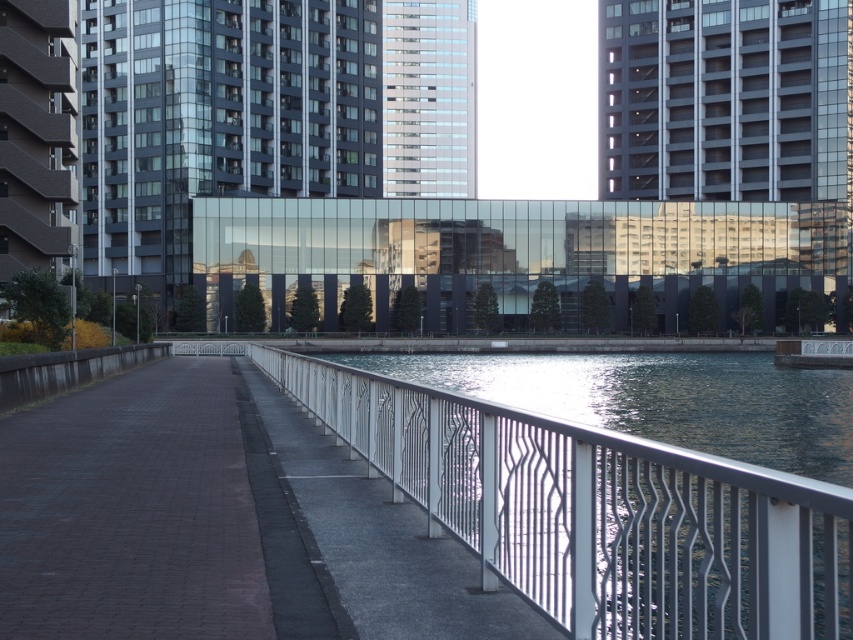
Question: Does metallic water at center have a greater width compared to transparent glass bridge at center?

Choices:
 (A) no
 (B) yes

Answer: (A)

Question: Can you confirm if metallic water at center is smaller than transparent glass bridge at center?

Choices:
 (A) yes
 (B) no

Answer: (A)

Question: Which of the following is the farthest from the observer?

Choices:
 (A) transparent glass bridge at center
 (B) metallic water at center

Answer: (A)

Question: Which point is closer to the camera taking this photo?

Choices:
 (A) (434, 234)
 (B) (685, 509)

Answer: (B)

Question: Is metallic water at center positioned at the back of transparent glass bridge at center?

Choices:
 (A) no
 (B) yes

Answer: (A)

Question: Among these points, which one is nearest to the camera?

Choices:
 (A) (753, 540)
 (B) (578, 321)

Answer: (A)